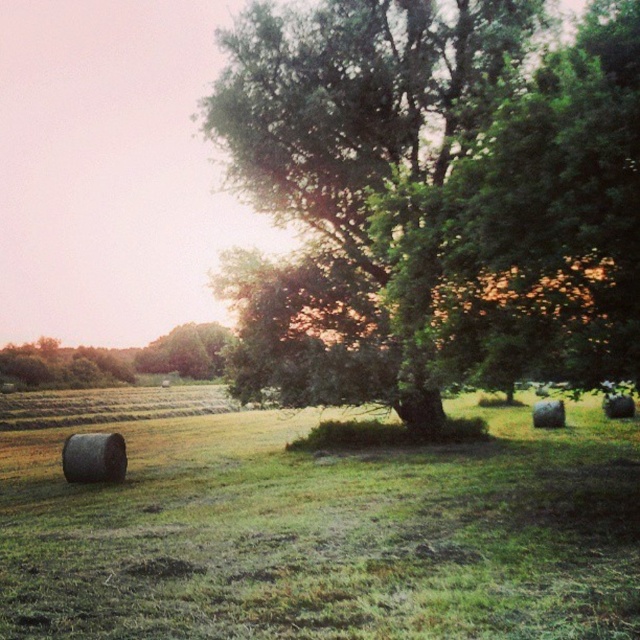
Between green leafy tree at center and green grass at lower left, which one is positioned lower?

green grass at lower left is lower down.

Is green leafy tree at center to the left of green grass at lower left from the viewer's perspective?

Incorrect, green leafy tree at center is not on the left side of green grass at lower left.

Between point (467, 253) and point (307, 470), which one is positioned in front?

Point (467, 253) is in front.

The image size is (640, 640). Find the location of `green leafy tree at center`. green leafy tree at center is located at coordinates (433, 196).